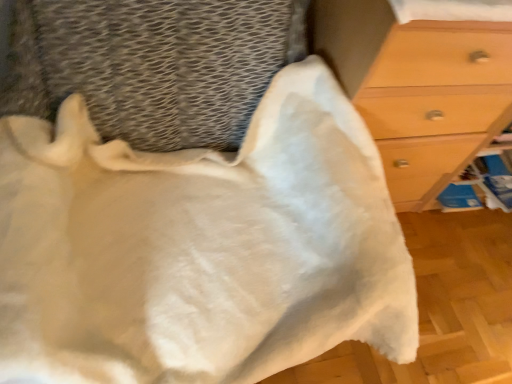
Question: Is matte wood chest of drawers at right taller than white fluffy blanket at upper center?

Choices:
 (A) yes
 (B) no

Answer: (A)

Question: Is matte wood chest of drawers at right smaller than white fluffy blanket at upper center?

Choices:
 (A) yes
 (B) no

Answer: (B)

Question: Is matte wood chest of drawers at right placed right next to white fluffy blanket at upper center?

Choices:
 (A) no
 (B) yes

Answer: (A)

Question: From the image's perspective, does matte wood chest of drawers at right appear lower than white fluffy blanket at upper center?

Choices:
 (A) yes
 (B) no

Answer: (B)

Question: Is the depth of matte wood chest of drawers at right less than that of white fluffy blanket at upper center?

Choices:
 (A) no
 (B) yes

Answer: (A)

Question: From a real-world perspective, is matte wood chest of drawers at right under white fluffy blanket at upper center?

Choices:
 (A) no
 (B) yes

Answer: (B)

Question: Considering the relative positions of white fluffy blanket at upper center and matte wood chest of drawers at right in the image provided, is white fluffy blanket at upper center to the right of matte wood chest of drawers at right from the viewer's perspective?

Choices:
 (A) yes
 (B) no

Answer: (B)

Question: Is white fluffy blanket at upper center outside matte wood chest of drawers at right?

Choices:
 (A) no
 (B) yes

Answer: (B)

Question: Is white fluffy blanket at upper center smaller than matte wood chest of drawers at right?

Choices:
 (A) no
 (B) yes

Answer: (B)

Question: Is white fluffy blanket at upper center wider than matte wood chest of drawers at right?

Choices:
 (A) no
 (B) yes

Answer: (B)

Question: Is matte wood chest of drawers at right located within white fluffy blanket at upper center?

Choices:
 (A) no
 (B) yes

Answer: (A)

Question: From a real-world perspective, does white fluffy blanket at upper center sit lower than matte wood chest of drawers at right?

Choices:
 (A) no
 (B) yes

Answer: (A)

Question: In the image, is matte wood chest of drawers at right on the left side or the right side of white fluffy blanket at upper center?

Choices:
 (A) left
 (B) right

Answer: (B)